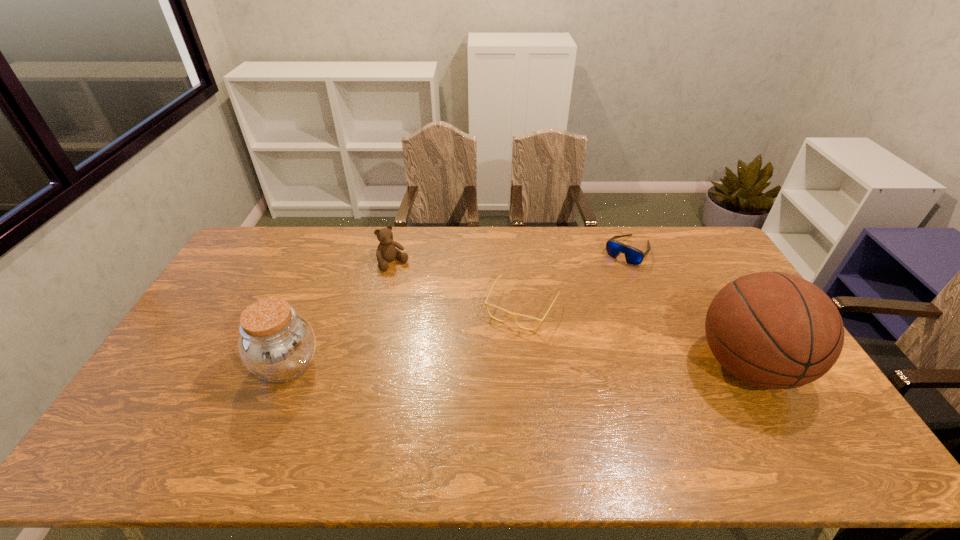
This screenshot has height=540, width=960. I want to click on free spot on the desktop that is between the leftmost object and the tallest object and is positioned on the front-facing side of the third shortest object, so click(483, 365).

The image size is (960, 540). Find the location of `free space on the desktop that is between the leftmost object and the basketball and is positioned on the front-facing side of the sunglasses`. free space on the desktop that is between the leftmost object and the basketball and is positioned on the front-facing side of the sunglasses is located at coordinates (535, 365).

Identify the location of free space on the desktop that is between the fourth shortest object and the basketball and is positioned in front of the lenses of the shortest object. The width and height of the screenshot is (960, 540). (492, 365).